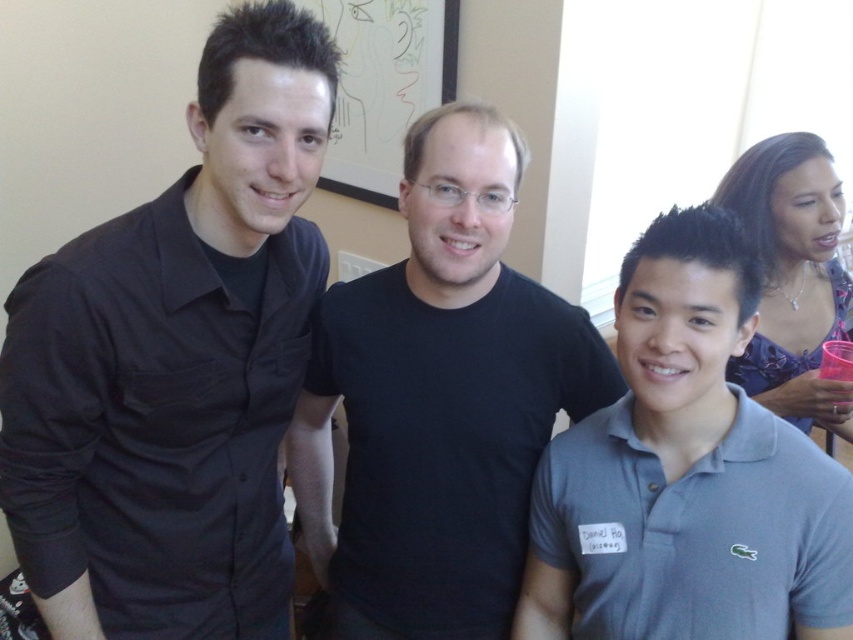
Question: Observing the image, what is the correct spatial positioning of gray cotton polo shirt at center in reference to blue floral dress at upper right?

Choices:
 (A) below
 (B) above

Answer: (A)

Question: Can you confirm if black matte shirt at left is positioned to the left of black matte t-shirt at center?

Choices:
 (A) no
 (B) yes

Answer: (B)

Question: Which of the following is the closest to the observer?

Choices:
 (A) gray cotton polo shirt at center
 (B) black matte t-shirt at center

Answer: (A)

Question: Which of these objects is positioned farthest from the gray cotton polo shirt at center?

Choices:
 (A) blue floral dress at upper right
 (B) black matte t-shirt at center

Answer: (A)

Question: Does black matte t-shirt at center appear on the right side of blue floral dress at upper right?

Choices:
 (A) no
 (B) yes

Answer: (A)

Question: Which of these objects is positioned farthest from the black matte shirt at left?

Choices:
 (A) gray cotton polo shirt at center
 (B) blue floral dress at upper right

Answer: (B)